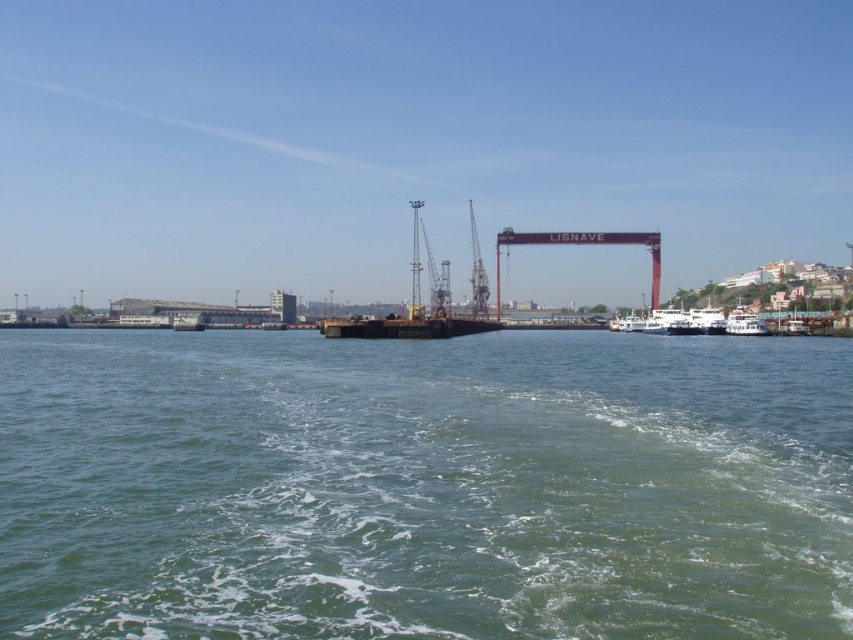
Question: Which of the following is the farthest from the observer?

Choices:
 (A) (471, 292)
 (B) (340, 419)

Answer: (A)

Question: Which object appears farthest from the camera in this image?

Choices:
 (A) metallic industrial crane at center
 (B) green water at center

Answer: (A)

Question: From the image, what is the correct spatial relationship of green water at center in relation to metallic industrial crane at center?

Choices:
 (A) left
 (B) right

Answer: (A)

Question: Can you confirm if green water at center is positioned above metallic industrial crane at center?

Choices:
 (A) no
 (B) yes

Answer: (A)

Question: Does green water at center appear over metallic industrial crane at center?

Choices:
 (A) no
 (B) yes

Answer: (A)